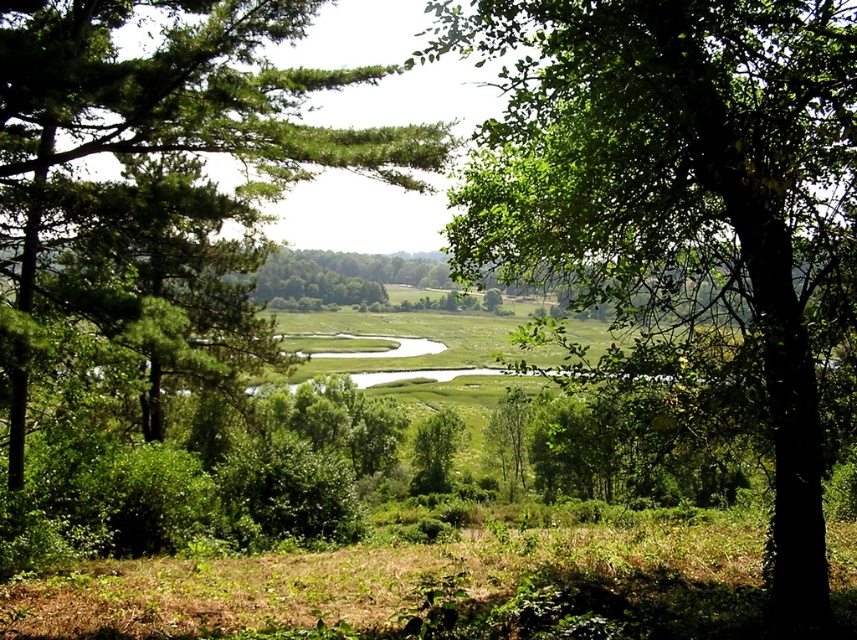
Question: Does green leafy tree at center have a lesser width compared to green leafy tree at left?

Choices:
 (A) no
 (B) yes

Answer: (B)

Question: Among these points, which one is farthest from the camera?

Choices:
 (A) (256, 224)
 (B) (802, 170)

Answer: (A)

Question: Does green leafy tree at center lie in front of green leafy tree at left?

Choices:
 (A) yes
 (B) no

Answer: (A)

Question: Does green leafy tree at center have a larger size compared to green leafy tree at left?

Choices:
 (A) yes
 (B) no

Answer: (A)